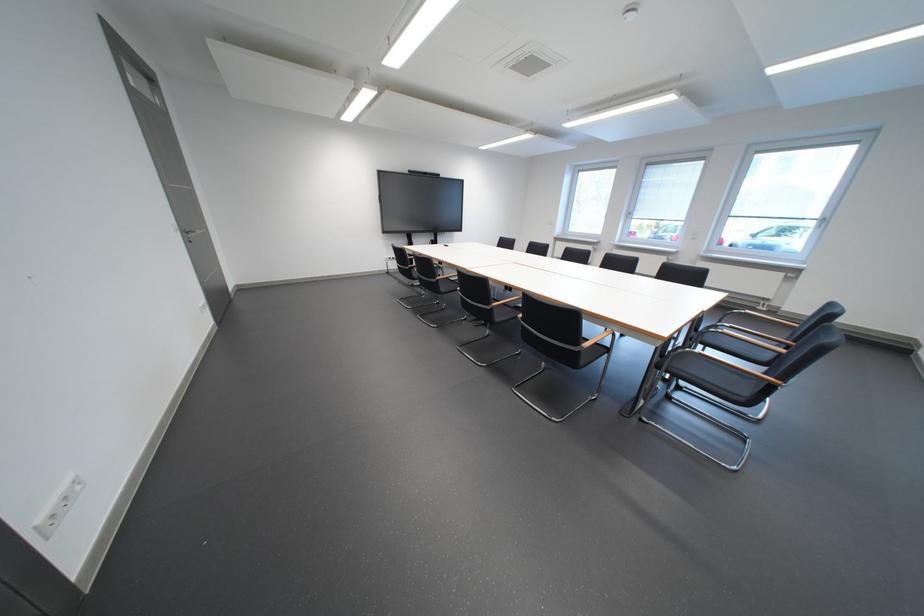
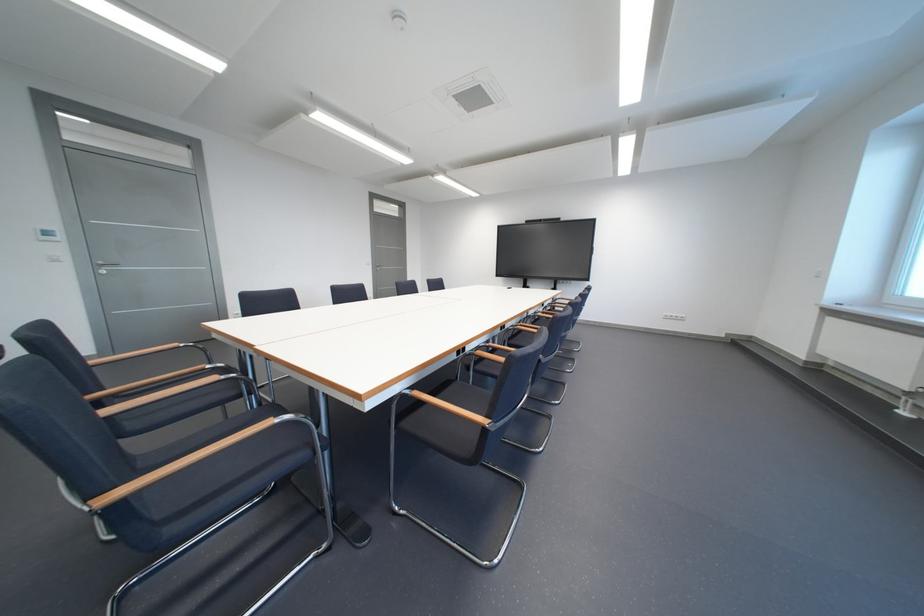
Question: I am providing you with two images of the same scene from different viewpoints. After the viewpoint changes to image2, which objects are now occluded?

Choices:
 (A) silver door handle
 (B) chair sitting surface
 (C) glass bell jar
 (D) black chair sitting surface

Answer: (D)